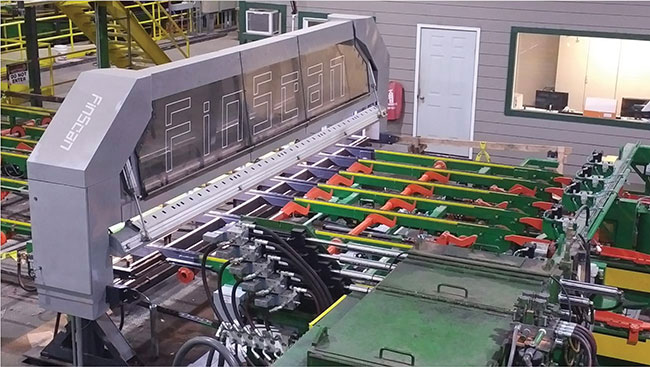
The width and height of the screenshot is (650, 367). I want to click on handrail, so click(x=177, y=27), click(x=158, y=5).